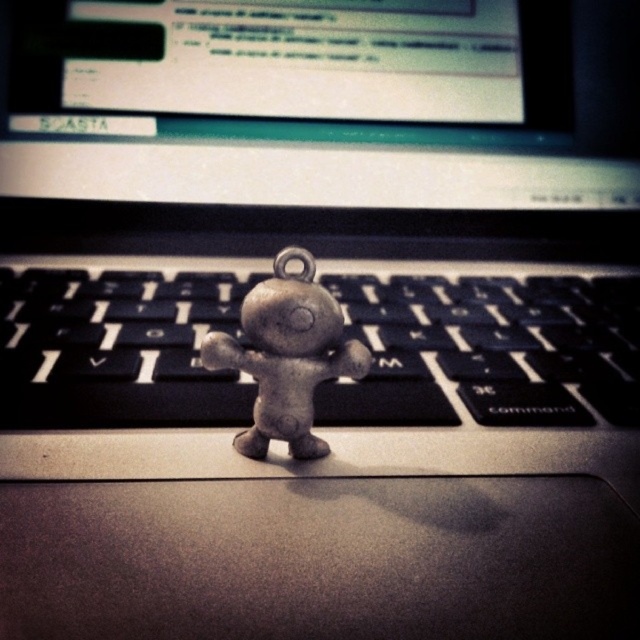
Who is more distant from viewer, [60,346] or [260,308]?

Positioned behind is point [60,346].

This screenshot has height=640, width=640. What do you see at coordinates (486, 349) in the screenshot? I see `black matte keyboard at center` at bounding box center [486, 349].

Find the location of a particular element. black matte keyboard at center is located at coordinates (486, 349).